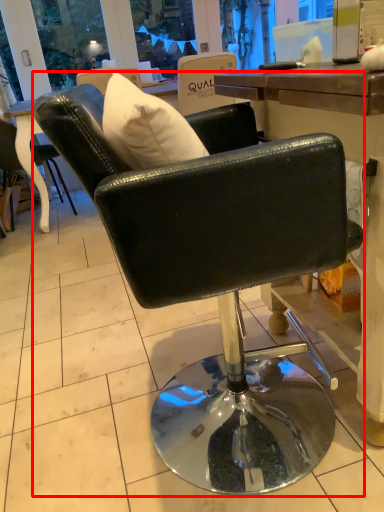
Question: Where is chair (annotated by the red box) located in relation to chair in the image?

Choices:
 (A) right
 (B) left

Answer: (A)